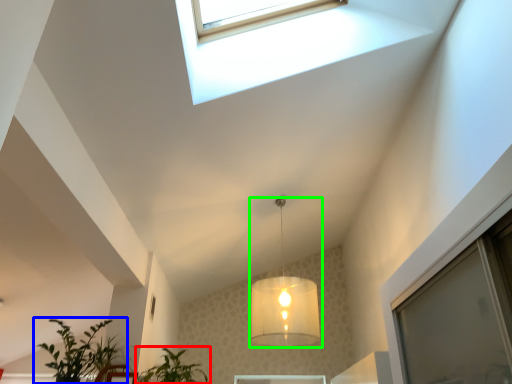
Question: Which object is the closest to the houseplant (highlighted by a red box)? Choose among these: houseplant (highlighted by a blue box) or lamp (highlighted by a green box).

Choices:
 (A) houseplant
 (B) lamp

Answer: (A)